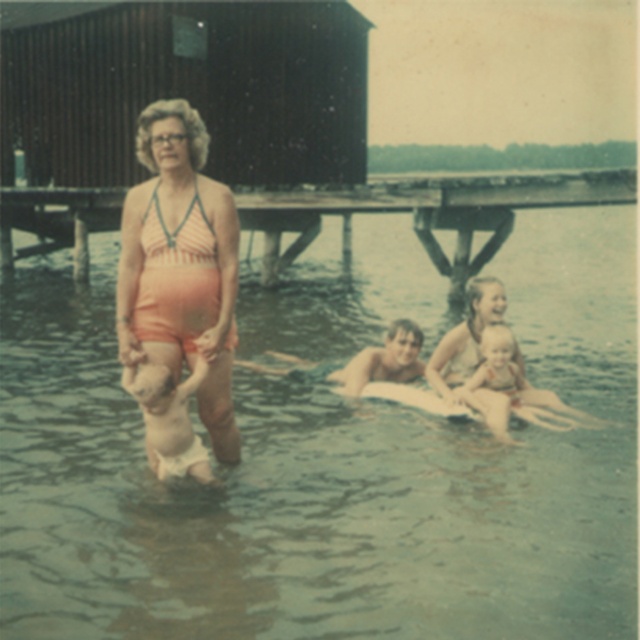
How much distance is there between orange striped swimsuit at center and light pink fabric diaper at lower left?

The distance of orange striped swimsuit at center from light pink fabric diaper at lower left is 16.37 inches.

Does orange striped swimsuit at center appear on the right side of light pink fabric diaper at lower left?

Correct, you'll find orange striped swimsuit at center to the right of light pink fabric diaper at lower left.

At what (x,y) coordinates should I click in order to perform the action: click on orange striped swimsuit at center. Please return your answer as a coordinate pair (x, y). Looking at the image, I should click on (180, 262).

Who is positioned more to the right, light pink fabric diaper at lower left or orange fabric swimsuit at center?

orange fabric swimsuit at center

Between point (156, 410) and point (481, 371), which one is positioned behind?

The point (481, 371) is more distant.

Locate an element on the screen. The image size is (640, 640). light pink fabric diaper at lower left is located at coordinates (170, 419).

Is point (294, 241) positioned after point (184, 429)?

Yes.

This screenshot has height=640, width=640. What are the coordinates of `wooden at upper center` in the screenshot? It's located at (428, 211).

The height and width of the screenshot is (640, 640). Find the location of `wooden at upper center`. wooden at upper center is located at coordinates (428, 211).